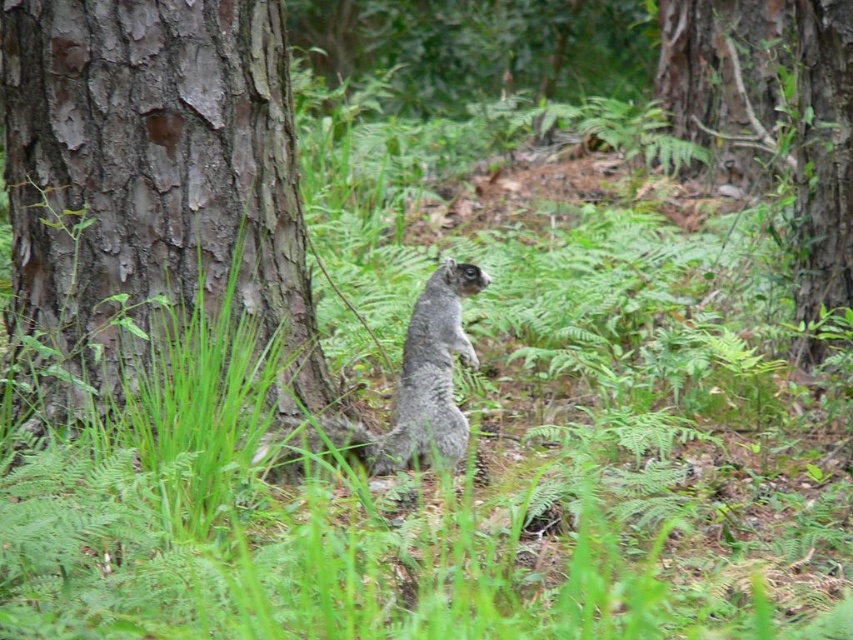
Question: Which is nearer to the gray furry squirrel at center?

Choices:
 (A) rough bark tree at center
 (B) brown rough bark tree trunk at left

Answer: (B)

Question: Is brown rough bark tree trunk at left to the left of rough bark tree at center from the viewer's perspective?

Choices:
 (A) yes
 (B) no

Answer: (A)

Question: Is brown rough bark tree trunk at left to the left of gray furry squirrel at center from the viewer's perspective?

Choices:
 (A) yes
 (B) no

Answer: (A)

Question: Which point is farther to the camera?

Choices:
 (A) (393, 428)
 (B) (735, 51)

Answer: (B)

Question: Estimate the real-world distances between objects in this image. Which object is closer to the gray furry squirrel at center?

Choices:
 (A) brown rough bark tree trunk at left
 (B) rough bark tree at center

Answer: (A)

Question: Is brown rough bark tree trunk at left in front of gray furry squirrel at center?

Choices:
 (A) yes
 (B) no

Answer: (A)